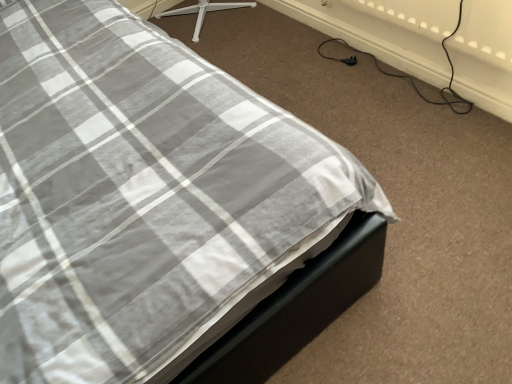
Question: Can you confirm if black plastic plug at lower right is bigger than black rubber cable at lower right?

Choices:
 (A) yes
 (B) no

Answer: (B)

Question: Is black plastic plug at lower right oriented towards black rubber cable at lower right?

Choices:
 (A) no
 (B) yes

Answer: (A)

Question: Considering the relative sizes of black plastic plug at lower right and black rubber cable at lower right in the image provided, is black plastic plug at lower right smaller than black rubber cable at lower right?

Choices:
 (A) yes
 (B) no

Answer: (A)

Question: Can you confirm if black plastic plug at lower right is wider than black rubber cable at lower right?

Choices:
 (A) no
 (B) yes

Answer: (A)

Question: From the image's perspective, would you say black plastic plug at lower right is shown under black rubber cable at lower right?

Choices:
 (A) yes
 (B) no

Answer: (A)

Question: Is black plastic plug at lower right further to camera compared to black rubber cable at lower right?

Choices:
 (A) yes
 (B) no

Answer: (A)

Question: Does black rubber cable at lower right turn towards black plastic plug at lower right?

Choices:
 (A) yes
 (B) no

Answer: (B)

Question: From a real-world perspective, is black rubber cable at lower right physically above black plastic plug at lower right?

Choices:
 (A) no
 (B) yes

Answer: (B)

Question: Does black rubber cable at lower right come behind black plastic plug at lower right?

Choices:
 (A) yes
 (B) no

Answer: (B)

Question: Is black rubber cable at lower right thinner than black plastic plug at lower right?

Choices:
 (A) yes
 (B) no

Answer: (B)

Question: Considering the relative positions of black rubber cable at lower right and black plastic plug at lower right in the image provided, is black rubber cable at lower right to the left of black plastic plug at lower right from the viewer's perspective?

Choices:
 (A) yes
 (B) no

Answer: (B)

Question: Is black rubber cable at lower right smaller than black plastic plug at lower right?

Choices:
 (A) no
 (B) yes

Answer: (A)

Question: Looking at their shapes, would you say black rubber cable at lower right is wider or thinner than black plastic plug at lower right?

Choices:
 (A) thin
 (B) wide

Answer: (B)